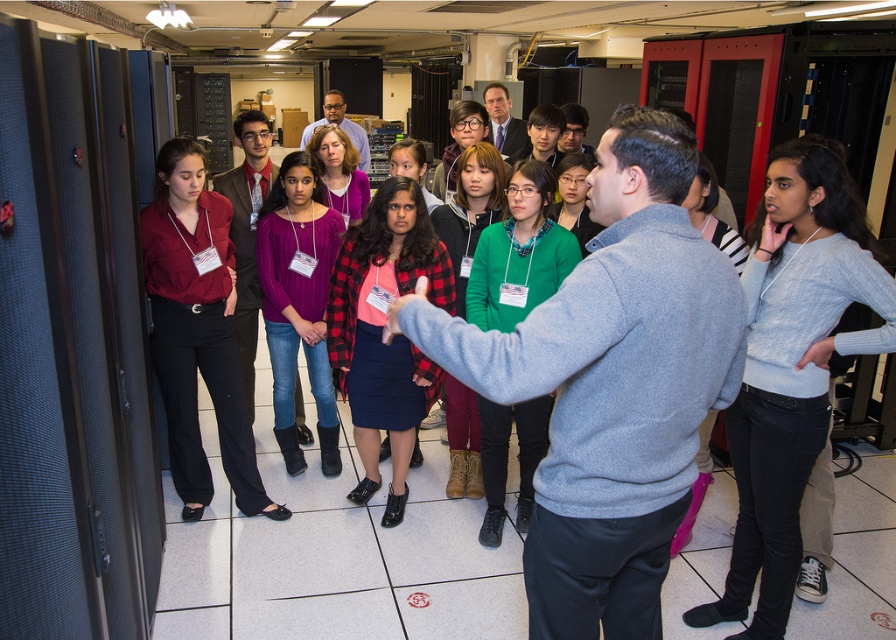
Based on the photo, you are a security guard in the server room. You need to identify the presenter based on their clothing. The presenter is the person wearing the light gray sweater at center. Which clothing item is positioned lower on their body compared to the plaid fabric shirt at center?

The light gray sweater at center is positioned lower on the presenter compared to the plaid fabric shirt at center, as it is described as being below the plaid fabric shirt at center.

You are a security guard in the server room. You need to identify the person in the center based on their clothing. Which item of clothing is taller, the light gray sweater at center or the matte black pants at center?

The light gray sweater at center has a greater height compared to the matte black pants at center, so the light gray sweater at center is taller.